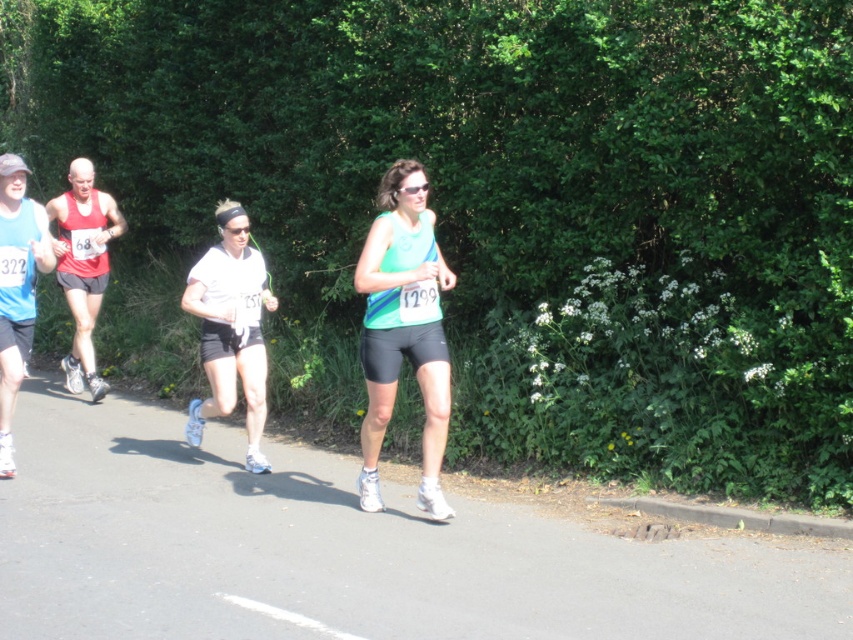
Question: Among these objects, which one is farthest from the camera?

Choices:
 (A) matte blue tank top at left
 (B) matte green tank top at center

Answer: (A)

Question: Which object appears closest to the camera in this image?

Choices:
 (A) white matte shorts at center
 (B) matte blue tank top at left

Answer: (B)

Question: Does matte green tank top at center appear on the right side of matte blue tank top at left?

Choices:
 (A) no
 (B) yes

Answer: (B)

Question: Is matte green tank top at center wider than white matte shorts at center?

Choices:
 (A) yes
 (B) no

Answer: (B)

Question: Which object is positioned farthest from the matte green tank top at center?

Choices:
 (A) white matte shorts at center
 (B) matte blue tank top at left

Answer: (B)

Question: Does white matte shorts at center have a larger size compared to matte blue tank top at left?

Choices:
 (A) yes
 (B) no

Answer: (A)